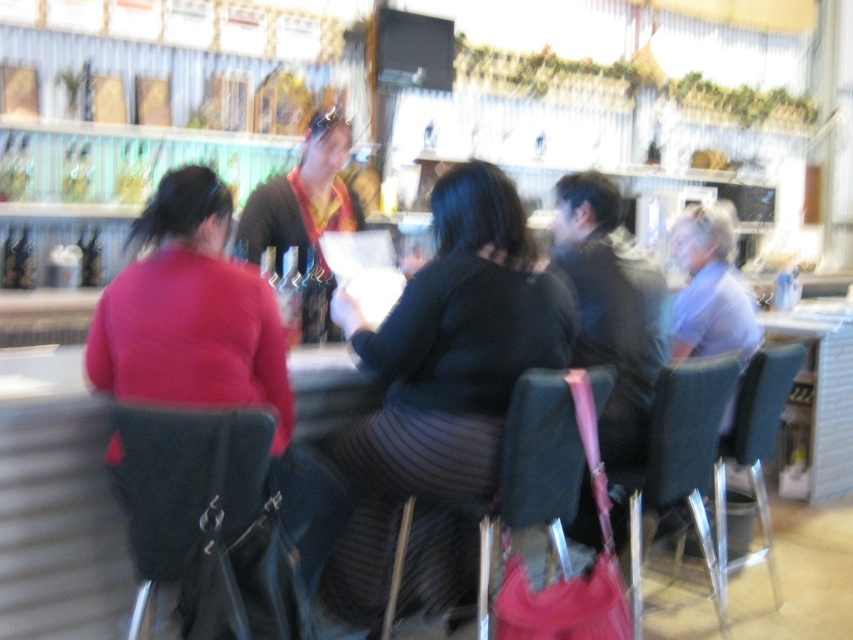
Which of these two, black leather chair at left or blue fabric chair at right, stands shorter?

black leather chair at left is shorter.

Consider the image. Between black leather chair at left and blue fabric chair at right, which one appears on the left side from the viewer's perspective?

black leather chair at left is more to the left.

Between point (238, 410) and point (728, 556), which one is positioned behind?

Point (728, 556)

Where is `black leather chair at left`? black leather chair at left is located at coordinates (193, 502).

Can you confirm if black textured sweater at center is smaller than matte red sweater at left?

Incorrect, black textured sweater at center is not smaller in size than matte red sweater at left.

Between black textured sweater at center and matte red sweater at left, which one has less height?

With less height is matte red sweater at left.

Who is more forward, (399, 422) or (120, 385)?

Positioned in front is point (120, 385).

Where is `black textured sweater at center`? black textured sweater at center is located at coordinates (440, 396).

Does black textured sweater at center have a lesser width compared to black leather chair at left?

No, black textured sweater at center is not thinner than black leather chair at left.

Which is behind, point (573, 317) or point (242, 432)?

The point (573, 317) is behind.

At what (x,y) coordinates should I click in order to perform the action: click on black textured sweater at center. Please return your answer as a coordinate pair (x, y). The image size is (853, 640). Looking at the image, I should click on (440, 396).